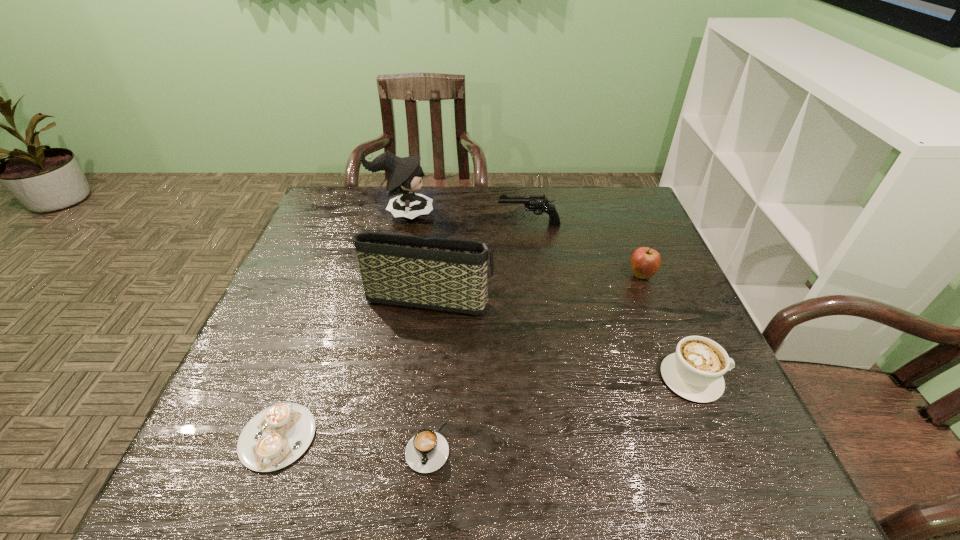
Identify the location of vacant area that lies between the second cappuccino from left to right and the handbag. (428, 369).

Where is `vacant space that's between the apple and the leftmost cappuccino`? This screenshot has height=540, width=960. vacant space that's between the apple and the leftmost cappuccino is located at coordinates (460, 356).

Locate an element on the screen. free space between the gun and the shortest cappuccino is located at coordinates (403, 330).

Find the location of a particular element. vacant space in between the handbag and the apple is located at coordinates (535, 284).

Where is `unoccupied area between the doll and the apple`? This screenshot has height=540, width=960. unoccupied area between the doll and the apple is located at coordinates (522, 245).

At what (x,y) coordinates should I click in order to perform the action: click on vacant region between the apple and the handbag. Please return your answer as a coordinate pair (x, y). Looking at the image, I should click on (535, 284).

What are the coordinates of `vacant area between the rightmost cappuccino and the handbag` in the screenshot? It's located at (561, 335).

Find the location of a particular element. This screenshot has width=960, height=540. free space between the shortest object and the third shortest object is located at coordinates tap(485, 407).

Where is `object that is the closest to the third shortest object`? The image size is (960, 540). object that is the closest to the third shortest object is located at coordinates (645, 262).

You are a GUI agent. You are given a task and a screenshot of the screen. Output one action in this format:
    pyautogui.click(x=<x>, y=<y>)
    Task: Click on the object identified as the second closest to the handbag
    The height and width of the screenshot is (540, 960).
    Given the screenshot: What is the action you would take?
    pyautogui.click(x=534, y=203)